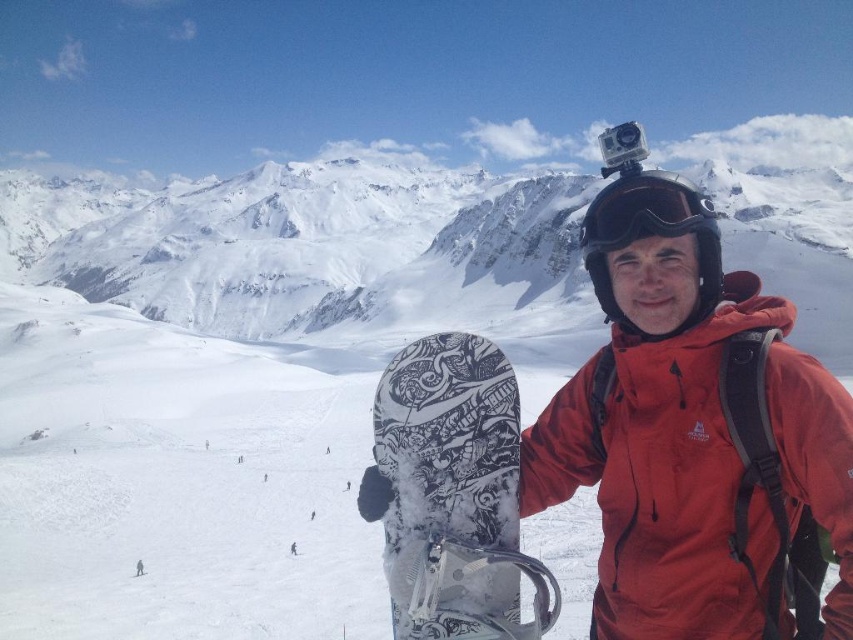
Question: Can you confirm if white matte snowboard at center is positioned to the right of black matte goggles at center?

Choices:
 (A) no
 (B) yes

Answer: (A)

Question: Can you confirm if white matte snowboard at center is bigger than black matte goggles at center?

Choices:
 (A) no
 (B) yes

Answer: (A)

Question: Is white matte snowboard at center above black matte goggles at center?

Choices:
 (A) yes
 (B) no

Answer: (B)

Question: Among these points, which one is farthest from the camera?

Choices:
 (A) (676, 204)
 (B) (505, 614)

Answer: (A)

Question: Which point is farther to the camera?

Choices:
 (A) (421, 355)
 (B) (688, 208)

Answer: (A)

Question: Which point is farther from the camera taking this photo?

Choices:
 (A) pyautogui.click(x=653, y=205)
 (B) pyautogui.click(x=450, y=576)

Answer: (A)